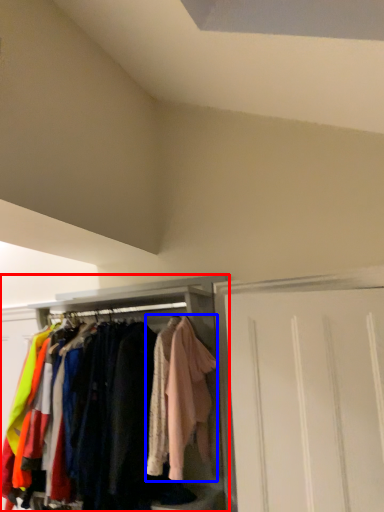
Question: Which object is closer to the camera taking this photo, cabinetry (highlighted by a red box) or clothing (highlighted by a blue box)?

Choices:
 (A) cabinetry
 (B) clothing

Answer: (B)